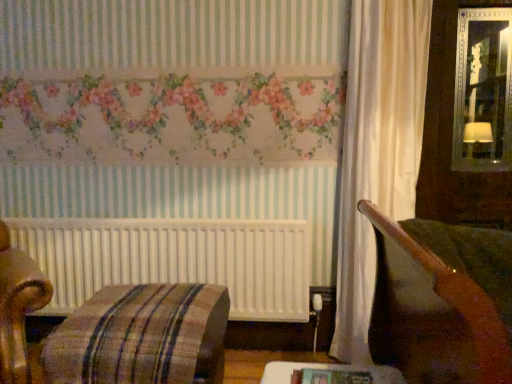
Where is `wooden table at lower center`? This screenshot has height=384, width=512. wooden table at lower center is located at coordinates (330, 373).

This screenshot has height=384, width=512. What do you see at coordinates (330, 373) in the screenshot? I see `wooden table at lower center` at bounding box center [330, 373].

What do you see at coordinates (111, 331) in the screenshot? I see `plaid fabric ottoman at lower left` at bounding box center [111, 331].

The image size is (512, 384). Identify the location of plaid fabric ottoman at lower left. (111, 331).

I want to click on wooden table at lower center, so click(x=330, y=373).

From the picture: Between plaid fabric ottoman at lower left and wooden table at lower center, which one appears on the right side from the viewer's perspective?

From the viewer's perspective, wooden table at lower center appears more on the right side.

Which is behind, plaid fabric ottoman at lower left or wooden table at lower center?

Positioned behind is plaid fabric ottoman at lower left.

Is point (205, 321) positioned in front of point (370, 381)?

No, it is behind (370, 381).

From the image's perspective, between plaid fabric ottoman at lower left and wooden table at lower center, who is located below?

From the image's view, plaid fabric ottoman at lower left is below.

From a real-world perspective, between plaid fabric ottoman at lower left and wooden table at lower center, who is vertically lower?

In real-world perspective, plaid fabric ottoman at lower left is lower.

Considering the sizes of plaid fabric ottoman at lower left and wooden table at lower center in the image, is plaid fabric ottoman at lower left wider or thinner than wooden table at lower center?

Clearly, plaid fabric ottoman at lower left has more width compared to wooden table at lower center.

Considering the relative sizes of plaid fabric ottoman at lower left and wooden table at lower center in the image provided, is plaid fabric ottoman at lower left shorter than wooden table at lower center?

Incorrect, the height of plaid fabric ottoman at lower left does not fall short of that of wooden table at lower center.

Based on their sizes in the image, would you say plaid fabric ottoman at lower left is bigger or smaller than wooden table at lower center?

In the image, plaid fabric ottoman at lower left appears to be larger than wooden table at lower center.

Which is correct: plaid fabric ottoman at lower left is inside wooden table at lower center, or outside of it?

plaid fabric ottoman at lower left cannot be found inside wooden table at lower center.

Is plaid fabric ottoman at lower left far from wooden table at lower center?

That's not correct — plaid fabric ottoman at lower left is a little close to wooden table at lower center.

Is plaid fabric ottoman at lower left aimed at wooden table at lower center?

No.

How different are the orientations of plaid fabric ottoman at lower left and wooden table at lower center in degrees?

They differ by 3.13 degrees in their facing directions.

At what (x,y) coordinates should I click in order to perform the action: click on table in front of the plaid fabric ottoman at lower left. Please return your answer as a coordinate pair (x, y). Looking at the image, I should click on (330, 373).

Which is more to the right, wooden table at lower center or plaid fabric ottoman at lower left?

Positioned to the right is wooden table at lower center.

Is wooden table at lower center behind plaid fabric ottoman at lower left?

No, it is in front of plaid fabric ottoman at lower left.

Does point (332, 370) come in front of point (104, 336)?

Yes, it is in front of point (104, 336).

From the image's perspective, who appears lower, wooden table at lower center or plaid fabric ottoman at lower left?

plaid fabric ottoman at lower left is shown below in the image.

Consider the image. From a real-world perspective, is wooden table at lower center below plaid fabric ottoman at lower left?

No, from a real-world perspective, wooden table at lower center is not under plaid fabric ottoman at lower left.

Can you confirm if wooden table at lower center is wider than plaid fabric ottoman at lower left?

Incorrect, the width of wooden table at lower center does not surpass that of plaid fabric ottoman at lower left.

Does wooden table at lower center have a greater height compared to plaid fabric ottoman at lower left?

In fact, wooden table at lower center may be shorter than plaid fabric ottoman at lower left.

Which of these two, wooden table at lower center or plaid fabric ottoman at lower left, is smaller?

wooden table at lower center is smaller.

Would you say wooden table at lower center contains plaid fabric ottoman at lower left?

Actually, plaid fabric ottoman at lower left is outside wooden table at lower center.

Is wooden table at lower center with plaid fabric ottoman at lower left?

wooden table at lower center is not next to plaid fabric ottoman at lower left, and they're not touching.

Is wooden table at lower center oriented away from plaid fabric ottoman at lower left?

wooden table at lower center is not turned away from plaid fabric ottoman at lower left.

Looking at this image, can you tell me how much wooden table at lower center and plaid fabric ottoman at lower left differ in facing direction?

The angular difference between wooden table at lower center and plaid fabric ottoman at lower left is 3.13 degrees.

Identify the location of furniture that is behind the wooden table at lower center. (111, 331).

Locate an element on the screen. This screenshot has width=512, height=384. table in front of the plaid fabric ottoman at lower left is located at coordinates point(330,373).

This screenshot has height=384, width=512. What are the coordinates of `furniture below the wooden table at lower center (from the image's perspective)` in the screenshot? It's located at (111, 331).